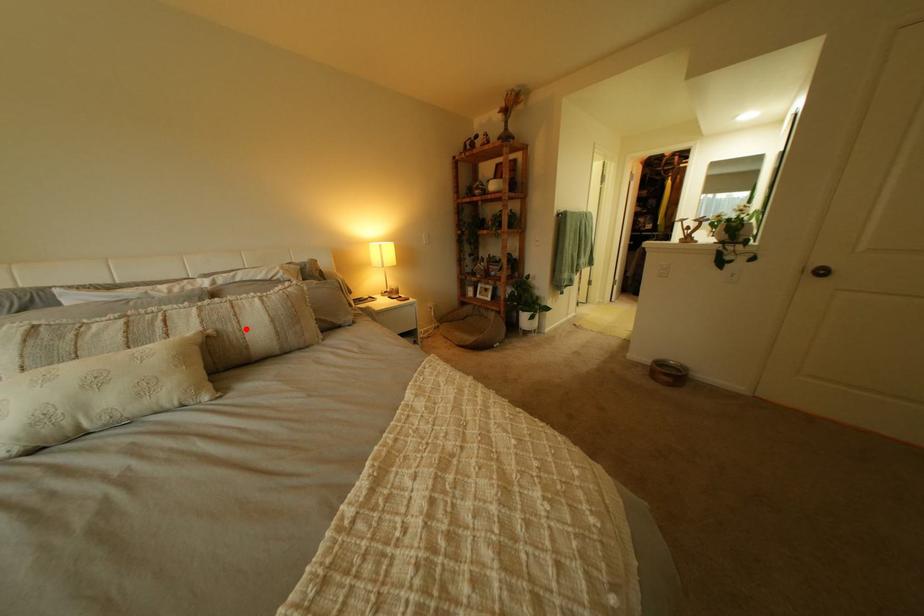
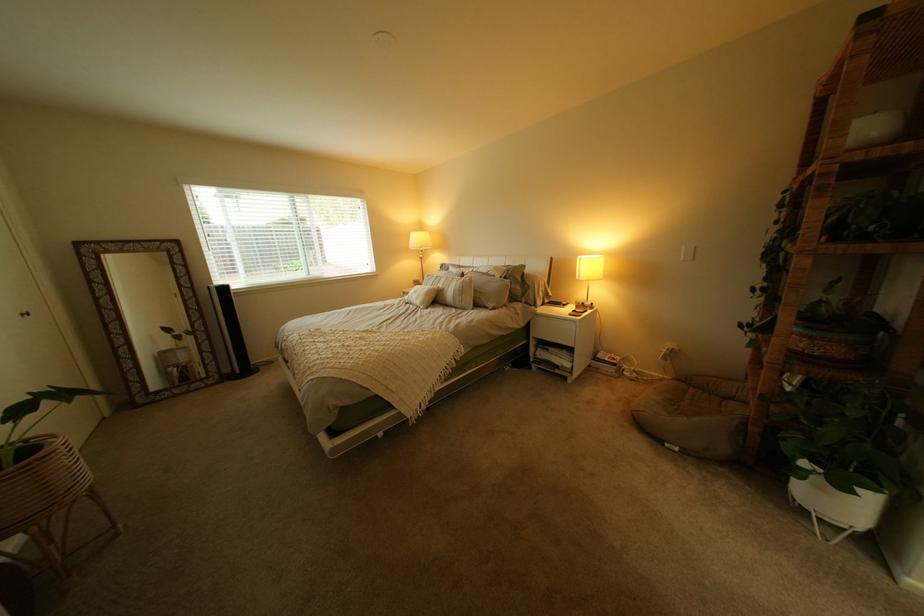
In the second image, find the point that corresponds to the highlighted location in the first image.

(462, 290)